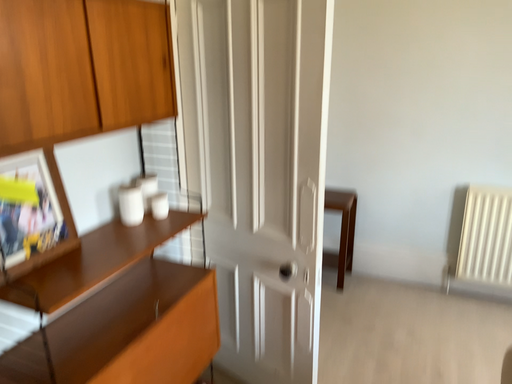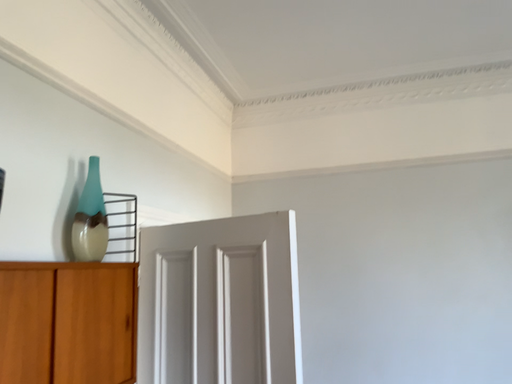
Question: How did the camera likely rotate when shooting the video?

Choices:
 (A) rotated right
 (B) rotated left

Answer: (A)